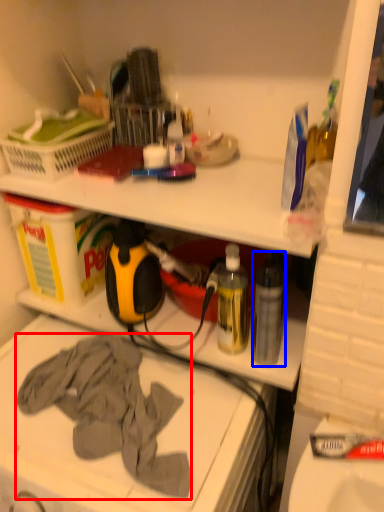
Question: Which point is further to the camera, clothing (highlighted by a red box) or bottle (highlighted by a blue box)?

Choices:
 (A) clothing
 (B) bottle

Answer: (B)